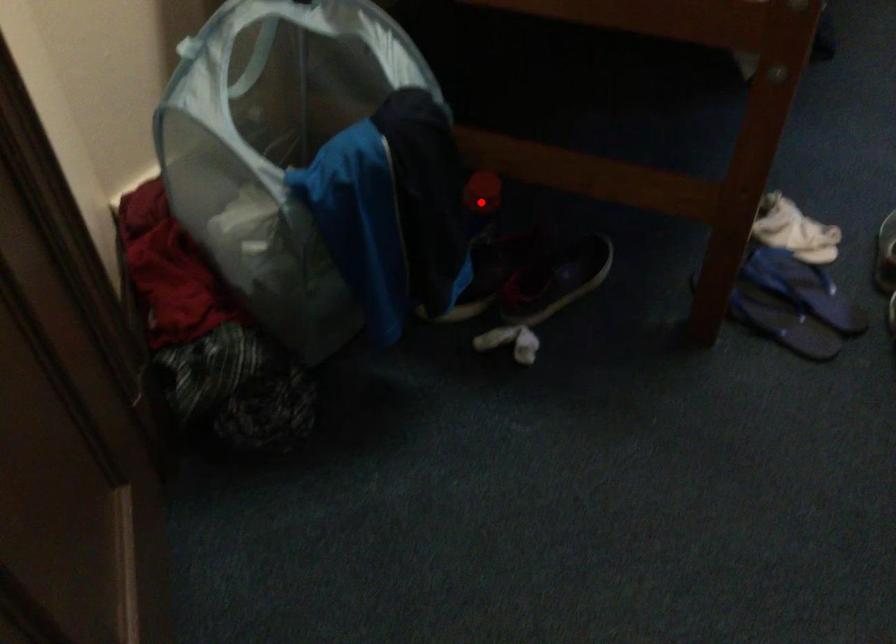
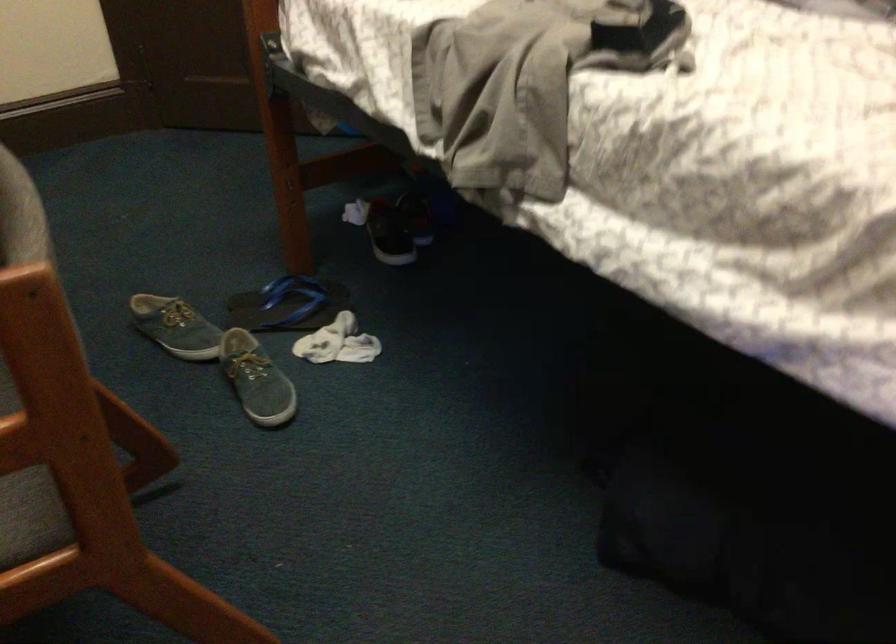
Question: I am providing you with two images of the same scene from different viewpoints. A red point is marked on the first image. At the location where the point appears in image 1, is it still visible in image 2?

Choices:
 (A) Yes
 (B) No

Answer: (B)